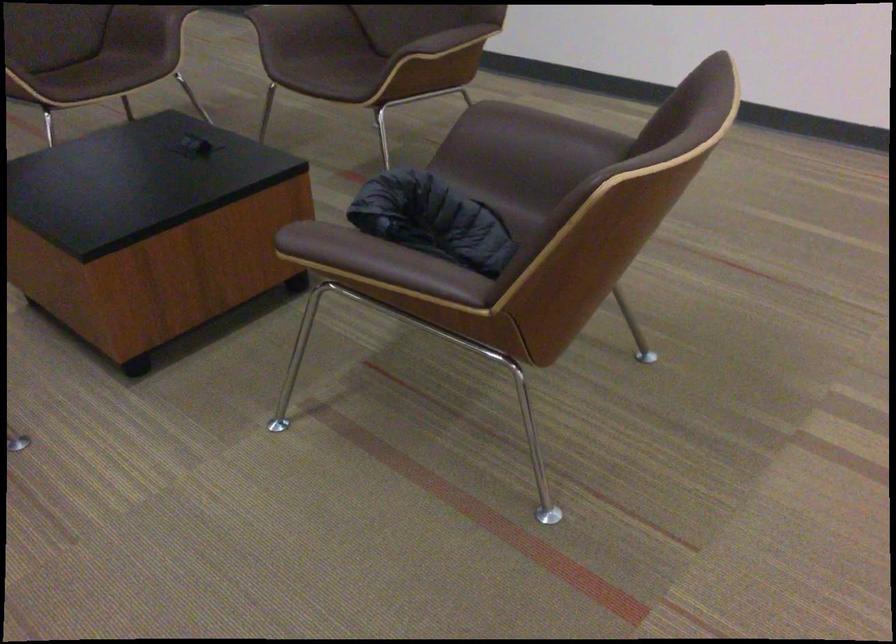
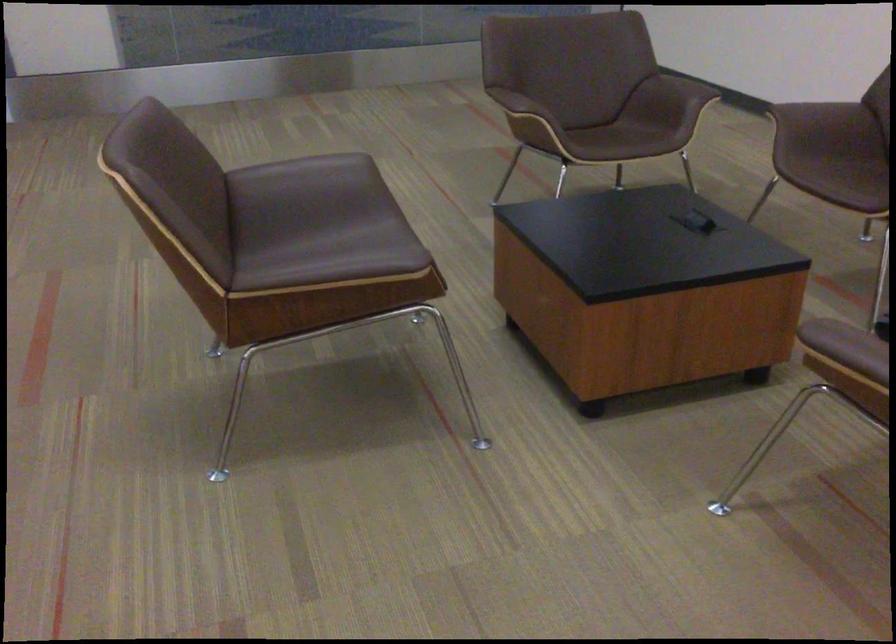
Question: How did the camera likely rotate?

Choices:
 (A) Left
 (B) Right
 (C) Up
 (D) Down

Answer: (A)